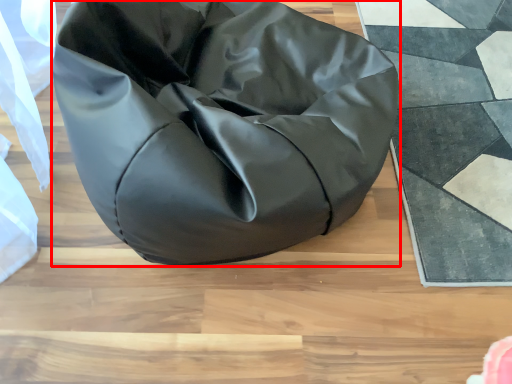
Question: Observing the image, what is the correct spatial positioning of furniture (annotated by the red box) in reference to mat?

Choices:
 (A) right
 (B) left

Answer: (B)